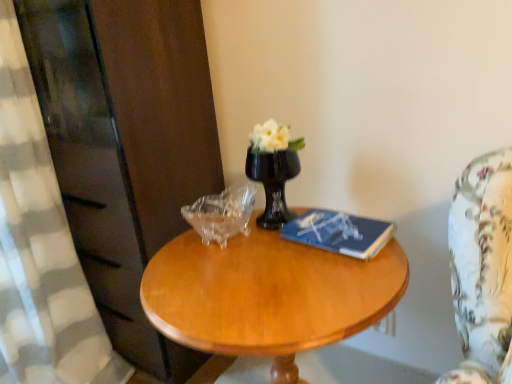
The width and height of the screenshot is (512, 384). What are the coordinates of `free location in front of transparent glass piggy bank at center` in the screenshot? It's located at point(219,271).